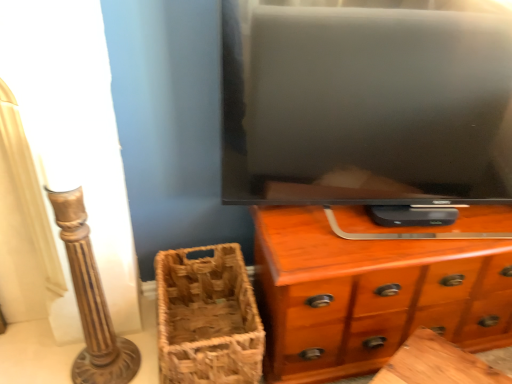
Question: From a real-world perspective, is brown woven basket at lower left above or below wooden chest of drawers at center?

Choices:
 (A) above
 (B) below

Answer: (B)

Question: Is brown woven basket at lower left to the left or to the right of wooden chest of drawers at center in the image?

Choices:
 (A) right
 (B) left

Answer: (B)

Question: In terms of height, does brown woven basket at lower left look taller or shorter compared to wooden chest of drawers at center?

Choices:
 (A) tall
 (B) short

Answer: (B)

Question: Is point (457, 301) closer or farther from the camera than point (240, 254)?

Choices:
 (A) closer
 (B) farther

Answer: (A)

Question: In the image, is wooden chest of drawers at center on the left side or the right side of brown woven basket at lower left?

Choices:
 (A) right
 (B) left

Answer: (A)

Question: In the image, is wooden chest of drawers at center positioned in front of or behind brown woven basket at lower left?

Choices:
 (A) front
 (B) behind

Answer: (A)

Question: In terms of size, does wooden chest of drawers at center appear bigger or smaller than brown woven basket at lower left?

Choices:
 (A) big
 (B) small

Answer: (A)